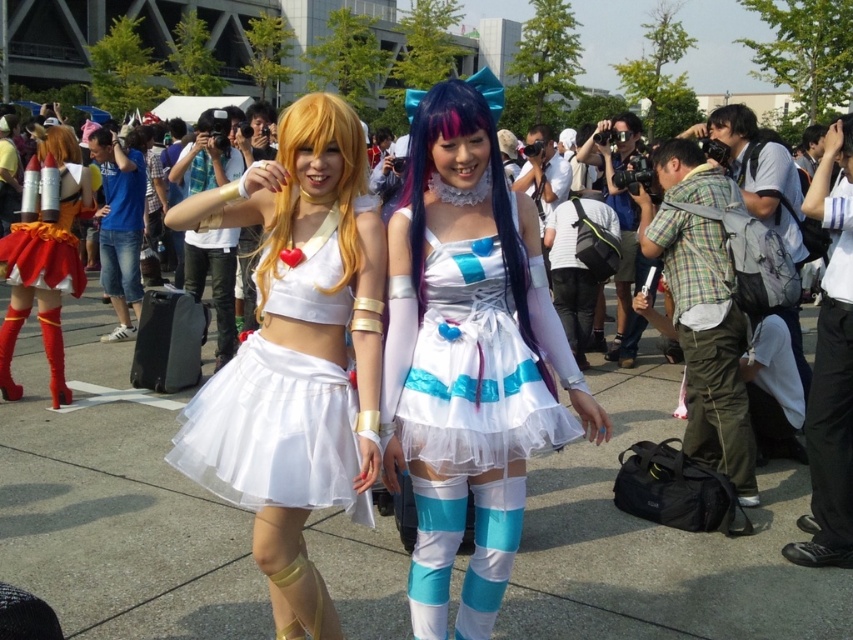
Question: Is shiny blue dress at center below shiny metallic rocket at left?

Choices:
 (A) no
 (B) yes

Answer: (B)

Question: In this image, where is shiny blue dress at center located relative to matte red boot at lower left?

Choices:
 (A) left
 (B) right

Answer: (B)

Question: Which point appears closest to the camera in this image?

Choices:
 (A) (396, 355)
 (B) (192, 452)
 (C) (68, 230)
 (D) (387, 356)

Answer: (A)

Question: Estimate the real-world distances between objects in this image. Which object is farther from the matte red thigh-high boot at lower left?

Choices:
 (A) white satin skirt at center
 (B) matte red boot at lower left

Answer: (A)

Question: Which object is the closest to the white satin skirt at center?

Choices:
 (A) matte red boot at lower left
 (B) shiny metallic rocket at left

Answer: (B)

Question: Does shiny blue dress at center have a lesser width compared to matte red boot at lower left?

Choices:
 (A) yes
 (B) no

Answer: (B)